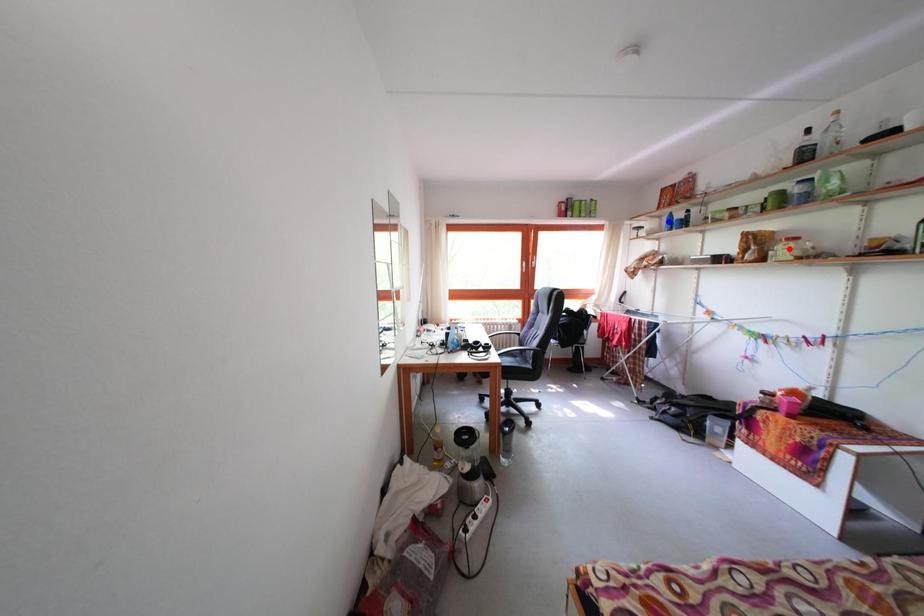
Question: In the image, two points are highlighted. Which point is nearer to the camera? Reply with the corresponding letter.

Choices:
 (A) blue point
 (B) red point

Answer: (B)